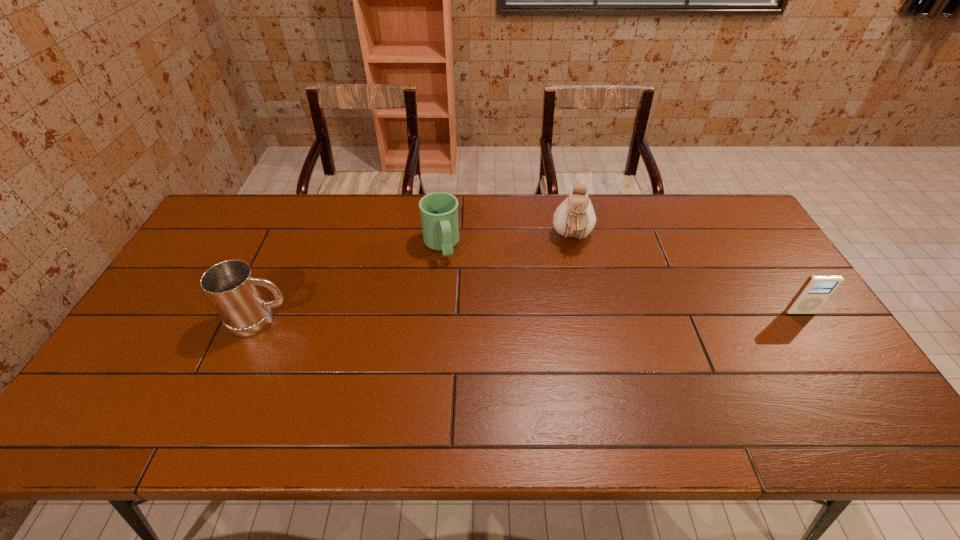
The image size is (960, 540). Find the location of `vacant space on the desktop that is between the nearer mug and the iPod and is positioned on the front-facing side of the pouch`. vacant space on the desktop that is between the nearer mug and the iPod and is positioned on the front-facing side of the pouch is located at coordinates (575, 315).

Where is `vacant space on the desktop that is between the leftmost object and the rightmost object and is positioned on the side of the shorter mug with the handle`? The width and height of the screenshot is (960, 540). vacant space on the desktop that is between the leftmost object and the rightmost object and is positioned on the side of the shorter mug with the handle is located at coordinates (465, 317).